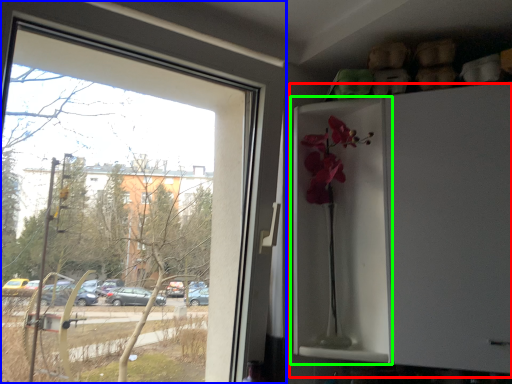
Question: Which object is positioned farthest from fridge (highlighted by a red box)? Select from window (highlighted by a blue box) and screen door (highlighted by a green box).

Choices:
 (A) window
 (B) screen door

Answer: (A)